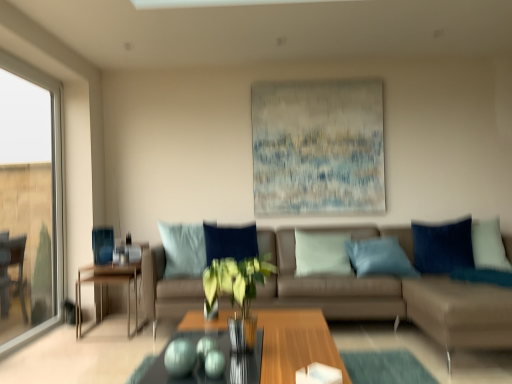
Question: Should I look upward or downward to see transparent glass window at left?

Choices:
 (A) down
 (B) up

Answer: (A)

Question: Does suede beige couch at center come behind wooden coffee table at center?

Choices:
 (A) yes
 (B) no

Answer: (A)

Question: Can you confirm if suede beige couch at center is positioned to the right of wooden coffee table at center?

Choices:
 (A) yes
 (B) no

Answer: (A)

Question: Is suede beige couch at center taller than wooden coffee table at center?

Choices:
 (A) yes
 (B) no

Answer: (A)

Question: Does suede beige couch at center appear on the left side of wooden coffee table at center?

Choices:
 (A) no
 (B) yes

Answer: (A)

Question: Can you confirm if suede beige couch at center is bigger than wooden coffee table at center?

Choices:
 (A) yes
 (B) no

Answer: (A)

Question: From the image's perspective, is suede beige couch at center beneath wooden coffee table at center?

Choices:
 (A) yes
 (B) no

Answer: (B)

Question: Can you confirm if transparent glass window at left is taller than suede beige couch at center?

Choices:
 (A) yes
 (B) no

Answer: (A)

Question: Is transparent glass window at left touching suede beige couch at center?

Choices:
 (A) no
 (B) yes

Answer: (A)

Question: Is transparent glass window at left to the left of suede beige couch at center from the viewer's perspective?

Choices:
 (A) yes
 (B) no

Answer: (A)

Question: From a real-world perspective, is transparent glass window at left positioned over suede beige couch at center based on gravity?

Choices:
 (A) yes
 (B) no

Answer: (A)

Question: Is transparent glass window at left facing away from suede beige couch at center?

Choices:
 (A) yes
 (B) no

Answer: (B)

Question: Is transparent glass window at left far away from suede beige couch at center?

Choices:
 (A) no
 (B) yes

Answer: (B)

Question: Are textured canvas painting at upper center and wooden table at left making contact?

Choices:
 (A) yes
 (B) no

Answer: (B)